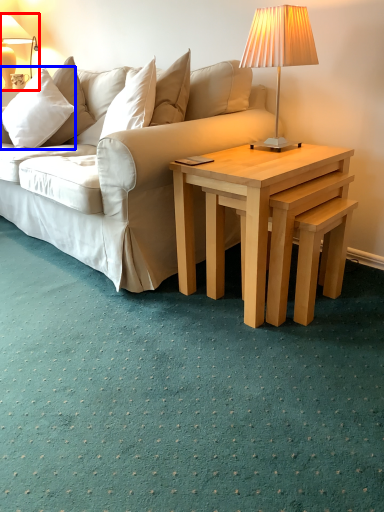
Question: Among these objects, which one is farthest to the camera, lamp (highlighted by a red box) or pillow (highlighted by a blue box)?

Choices:
 (A) lamp
 (B) pillow

Answer: (A)